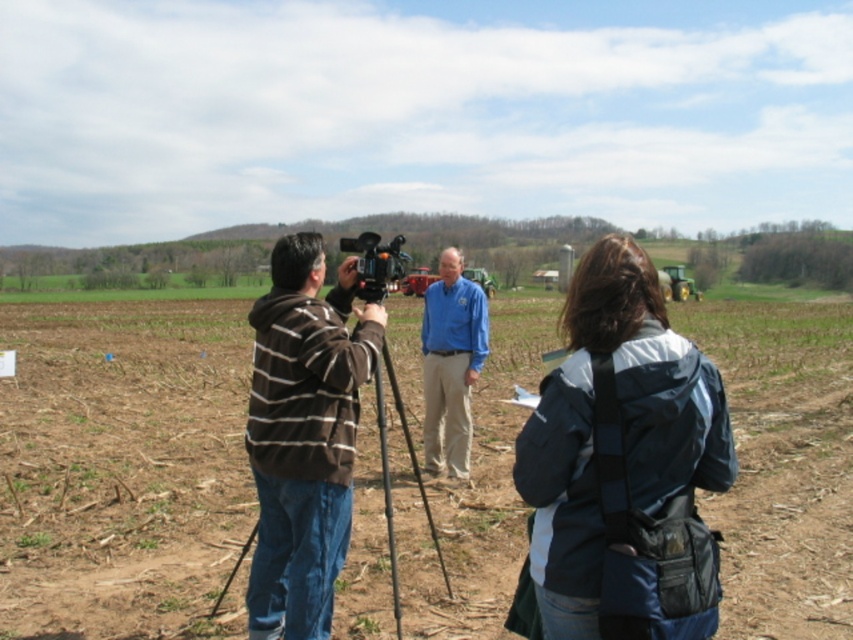
Question: Is blue cotton shirt at center to the right of black metal tripod at center from the viewer's perspective?

Choices:
 (A) no
 (B) yes

Answer: (B)

Question: Among these objects, which one is farthest from the camera?

Choices:
 (A) brown soil at center
 (B) dark blue jacket at center
 (C) brown striped hoodie at center
 (D) blue cotton shirt at center

Answer: (D)

Question: Among these objects, which one is farthest from the camera?

Choices:
 (A) dark blue jacket at center
 (B) brown striped hoodie at center

Answer: (B)

Question: Which of the following is the farthest from the observer?

Choices:
 (A) (299, 636)
 (B) (480, 353)
 (C) (160, 452)

Answer: (C)

Question: Does black metal tripod at center appear on the left side of black plastic camera at center?

Choices:
 (A) yes
 (B) no

Answer: (B)

Question: Does dark blue jacket at center come in front of black plastic camera at center?

Choices:
 (A) yes
 (B) no

Answer: (A)